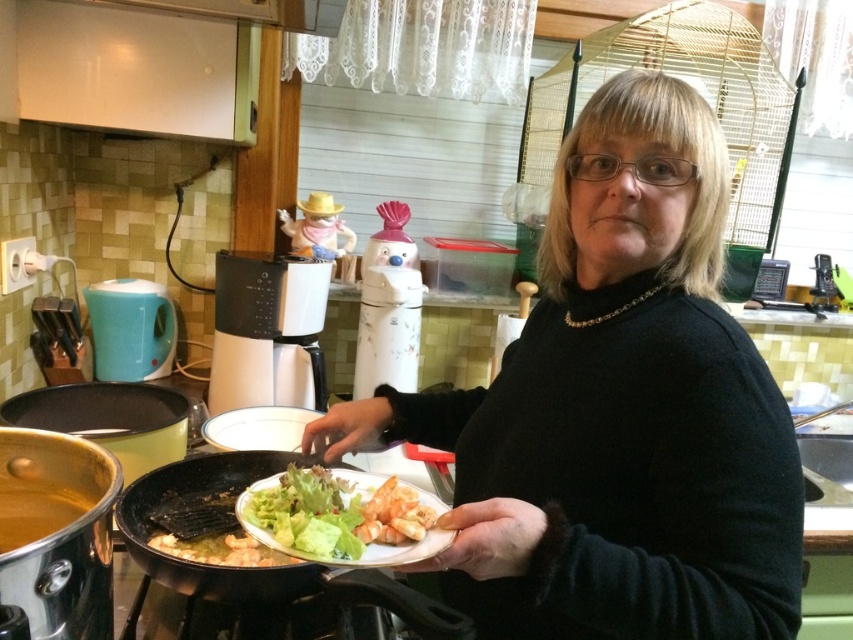
In the kitchen scene, you notice a black matte sweater at center and a fresh green salad at center. From the perspective of someone standing in front of the kitchen counter, which object is positioned to the left?

The fresh green salad at center is to the left of the black matte sweater at center.